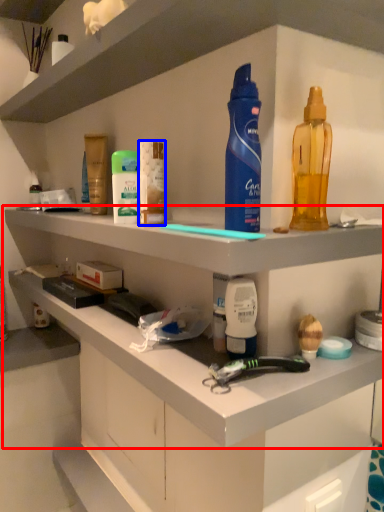
Question: Which of the following is the closest to the observer, shelf (highlighted by a red box) or toiletry (highlighted by a blue box)?

Choices:
 (A) shelf
 (B) toiletry

Answer: (A)